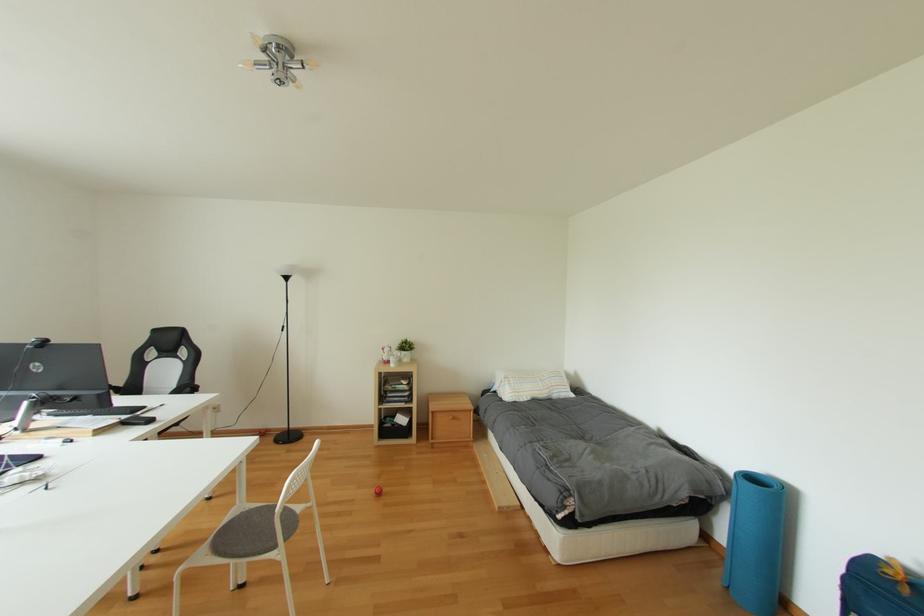
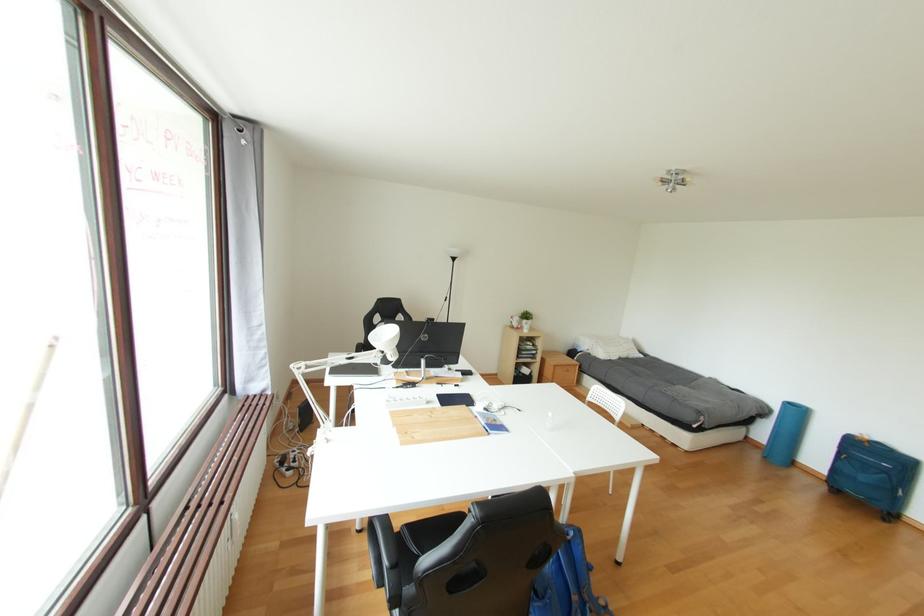
Question: The images are taken continuously from a first-person perspective. In which direction are you moving?

Choices:
 (A) Left
 (B) Right
 (C) Forward
 (D) Backward

Answer: (A)